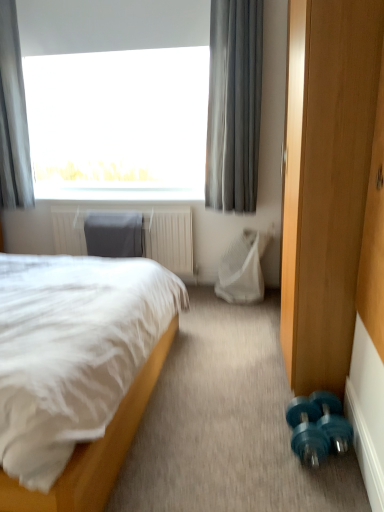
Question: Can you confirm if gray fabric curtain at upper left, which is the 2th curtain in right-to-left order, is positioned to the right of white mesh swivel chair at center, which is the second swivel chair in left-to-right order?

Choices:
 (A) yes
 (B) no

Answer: (B)

Question: Does gray fabric curtain at upper left, the first curtain viewed from the left, turn towards white mesh swivel chair at center, which is the second swivel chair in left-to-right order?

Choices:
 (A) yes
 (B) no

Answer: (B)

Question: From the image's perspective, does gray fabric curtain at upper left, the first curtain viewed from the left, appear lower than white mesh swivel chair at center, which is the second swivel chair in left-to-right order?

Choices:
 (A) no
 (B) yes

Answer: (A)

Question: Is gray fabric curtain at upper left, which is the 2th curtain in right-to-left order, positioned in front of white mesh swivel chair at center, the first swivel chair when ordered from right to left?

Choices:
 (A) yes
 (B) no

Answer: (A)

Question: Does gray fabric curtain at upper left, the first curtain viewed from the left, lie behind white mesh swivel chair at center, which is the second swivel chair in left-to-right order?

Choices:
 (A) no
 (B) yes

Answer: (A)

Question: From the image's perspective, is teal rubber dumbbell at lower right above or below teal plastic dumbbells at lower right?

Choices:
 (A) above
 (B) below

Answer: (B)

Question: From a real-world perspective, is teal rubber dumbbell at lower right physically located above or below teal plastic dumbbells at lower right?

Choices:
 (A) above
 (B) below

Answer: (B)

Question: Looking at the image, does teal rubber dumbbell at lower right seem bigger or smaller compared to teal plastic dumbbells at lower right?

Choices:
 (A) small
 (B) big

Answer: (A)

Question: Is teal rubber dumbbell at lower right wider or thinner than teal plastic dumbbells at lower right?

Choices:
 (A) wide
 (B) thin

Answer: (B)

Question: Considering their positions, is white soft bed at left located in front of or behind dark gray fabric swivel chair at center, acting as the second swivel chair starting from the right?

Choices:
 (A) front
 (B) behind

Answer: (A)

Question: Is white soft bed at left inside the boundaries of dark gray fabric swivel chair at center, the first swivel chair when ordered from left to right, or outside?

Choices:
 (A) inside
 (B) outside

Answer: (B)

Question: Considering the positions of white soft bed at left and dark gray fabric swivel chair at center, acting as the second swivel chair starting from the right, in the image, is white soft bed at left bigger or smaller than dark gray fabric swivel chair at center, acting as the second swivel chair starting from the right,?

Choices:
 (A) small
 (B) big

Answer: (B)

Question: From a real-world perspective, relative to dark gray fabric swivel chair at center, the first swivel chair when ordered from left to right, is white soft bed at left vertically above or below?

Choices:
 (A) above
 (B) below

Answer: (B)

Question: In terms of width, does white soft bed at left look wider or thinner when compared to white mesh swivel chair at center, the first swivel chair when ordered from right to left?

Choices:
 (A) thin
 (B) wide

Answer: (B)

Question: Visually, is white soft bed at left positioned to the left or to the right of white mesh swivel chair at center, the first swivel chair when ordered from right to left?

Choices:
 (A) left
 (B) right

Answer: (A)